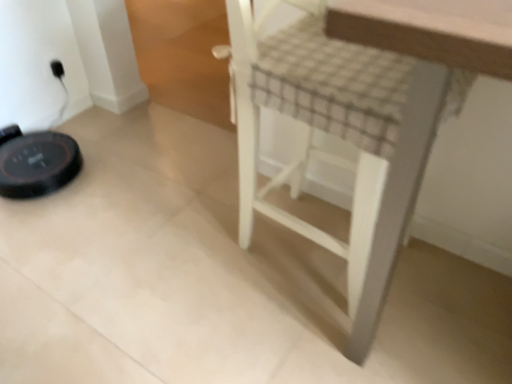
Describe the element at coordinates (355, 182) in the screenshot. The width and height of the screenshot is (512, 384). I see `white wood stool at center` at that location.

Locate an element on the screen. The height and width of the screenshot is (384, 512). white wood stool at center is located at coordinates click(355, 182).

Image resolution: width=512 pixels, height=384 pixels. I want to click on black plastic outlet at upper left, so click(57, 68).

The width and height of the screenshot is (512, 384). What do you see at coordinates (57, 68) in the screenshot? I see `black plastic outlet at upper left` at bounding box center [57, 68].

This screenshot has height=384, width=512. In order to click on white wood stool at center in this screenshot , I will do `click(355, 182)`.

Does black plastic outlet at upper left appear on the right side of white wood stool at center?

Incorrect, black plastic outlet at upper left is not on the right side of white wood stool at center.

Which object is closer to the camera, black plastic outlet at upper left or white wood stool at center?

white wood stool at center is more forward.

Considering the positions of points (56, 63) and (371, 211), is point (56, 63) farther from camera compared to point (371, 211)?

Yes, it is behind point (371, 211).

From the image's perspective, between black plastic outlet at upper left and white wood stool at center, who is located below?

From the image's view, white wood stool at center is below.

From a real-world perspective, is black plastic outlet at upper left located higher than white wood stool at center?

No.

Which object is thinner, black plastic outlet at upper left or white wood stool at center?

Thinner between the two is black plastic outlet at upper left.

Is black plastic outlet at upper left taller or shorter than white wood stool at center?

Considering their sizes, black plastic outlet at upper left has less height than white wood stool at center.

Can you confirm if black plastic outlet at upper left is bigger than white wood stool at center?

No, black plastic outlet at upper left is not bigger than white wood stool at center.

Is black plastic outlet at upper left not within white wood stool at center?

Yes, black plastic outlet at upper left is not within white wood stool at center.

Would you say black plastic outlet at upper left is a long distance from white wood stool at center?

Absolutely, black plastic outlet at upper left is distant from white wood stool at center.

In the scene shown: Is white wood stool at center at the back of black plastic outlet at upper left?

black plastic outlet at upper left does not have its back to white wood stool at center.

Consider the image. Measure the distance between black plastic outlet at upper left and white wood stool at center.

black plastic outlet at upper left is 4.89 feet away from white wood stool at center.

Identify the location of furniture below the black plastic outlet at upper left (from the image's perspective). The image size is (512, 384). (355, 182).

Is white wood stool at center at the left side of black plastic outlet at upper left?

Incorrect, white wood stool at center is not on the left side of black plastic outlet at upper left.

Which object is closer to the camera, white wood stool at center or black plastic outlet at upper left?

white wood stool at center.

Which is in front, point (410, 179) or point (56, 65)?

The point (410, 179) is closer to the camera.

From the image's perspective, does white wood stool at center appear lower than black plastic outlet at upper left?

Correct, white wood stool at center appears lower than black plastic outlet at upper left in the image.

From a real-world perspective, between white wood stool at center and black plastic outlet at upper left, who is vertically lower?

black plastic outlet at upper left is physically lower.

Considering the sizes of objects white wood stool at center and black plastic outlet at upper left in the image provided, who is wider, white wood stool at center or black plastic outlet at upper left?

white wood stool at center.

Who is taller, white wood stool at center or black plastic outlet at upper left?

With more height is white wood stool at center.

Considering the sizes of objects white wood stool at center and black plastic outlet at upper left in the image provided, who is bigger, white wood stool at center or black plastic outlet at upper left?

With larger size is white wood stool at center.

Could black plastic outlet at upper left be considered to be inside white wood stool at center?

That's incorrect, black plastic outlet at upper left is not inside white wood stool at center.

Would you consider white wood stool at center to be distant from black plastic outlet at upper left?

Yes, white wood stool at center is far from black plastic outlet at upper left.

Is white wood stool at center oriented away from black plastic outlet at upper left?

Absolutely, white wood stool at center is directed away from black plastic outlet at upper left.

Can you tell me how much white wood stool at center and black plastic outlet at upper left differ in facing direction?

0.00232 degrees.

Measure the distance from white wood stool at center to black plastic outlet at upper left.

white wood stool at center and black plastic outlet at upper left are 4.89 feet apart.

Where is `furniture on the right of black plastic outlet at upper left`? This screenshot has width=512, height=384. furniture on the right of black plastic outlet at upper left is located at coordinates (355, 182).

In the image, there is a black plastic outlet at upper left. At what (x,y) coordinates should I click in order to perform the action: click on furniture below it (from the image's perspective). Please return your answer as a coordinate pair (x, y). Looking at the image, I should click on (355, 182).

Locate an element on the screen. This screenshot has width=512, height=384. furniture located on the right of black plastic outlet at upper left is located at coordinates (355, 182).